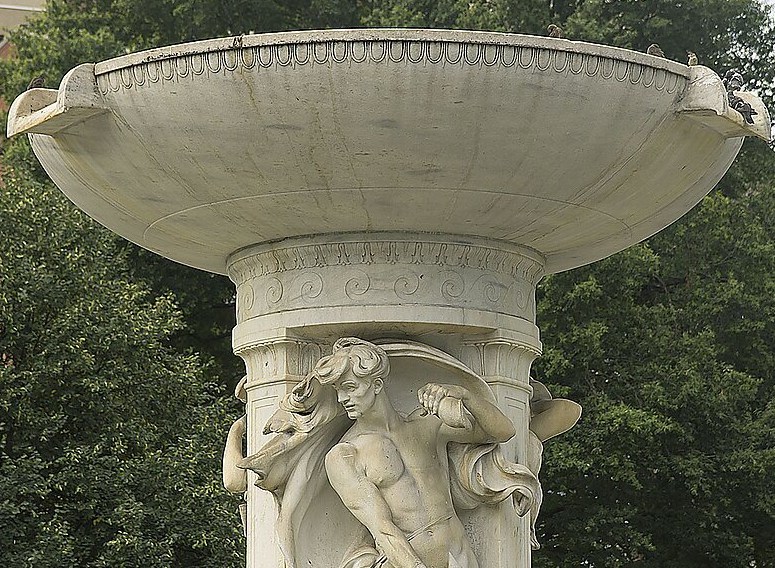
Identify the location of pillars. Image resolution: width=775 pixels, height=568 pixels. (257, 371), (508, 377).